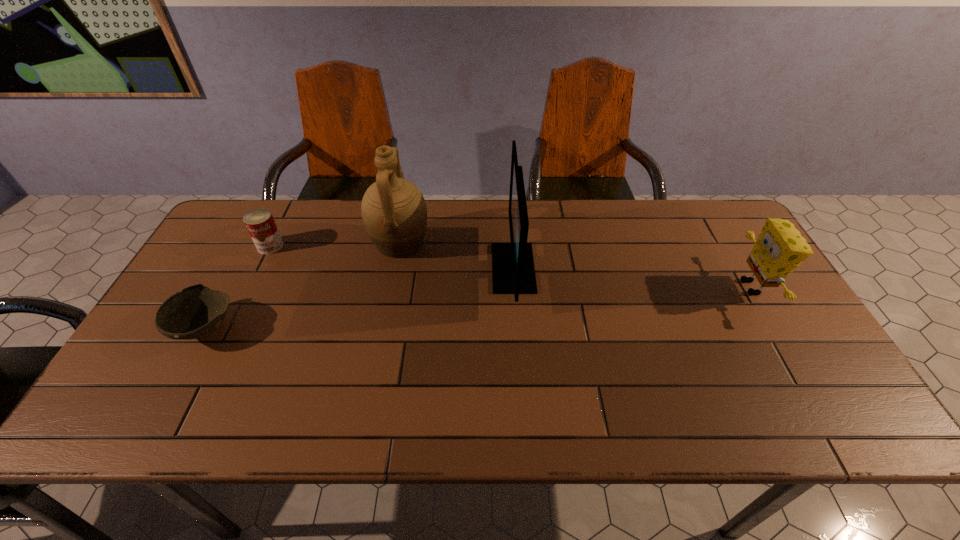
Image resolution: width=960 pixels, height=540 pixels. In order to click on free spot between the second object from right to left and the shortest object in this screenshot , I will do pyautogui.click(x=359, y=298).

Locate an element on the screen. This screenshot has width=960, height=540. free spot between the sponge and the bowl is located at coordinates (478, 307).

This screenshot has width=960, height=540. I want to click on free space that is in between the second object from right to left and the rightmost object, so click(x=633, y=278).

Identify the location of free space between the shortest object and the third object from left to right. The height and width of the screenshot is (540, 960). (302, 286).

Image resolution: width=960 pixels, height=540 pixels. I want to click on object that is the fourth closest to the can, so click(780, 248).

Select which object appears as the third closest to the third shortest object. Please provide its 2D coordinates. Your answer should be formatted as a tuple, i.e. [(x, y)], where the tuple contains the x and y coordinates of a point satisfying the conditions above.

[(260, 223)]